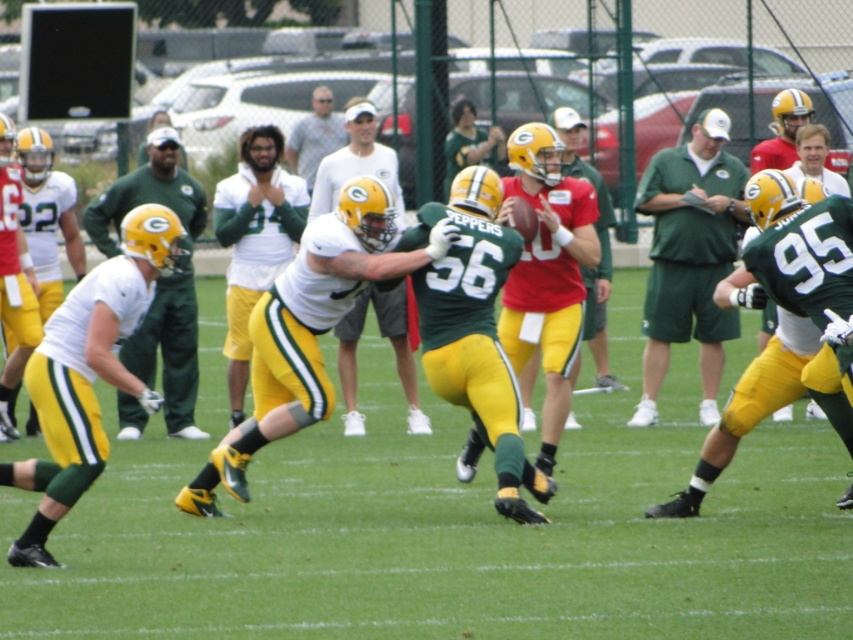
You are a sports equipment manager who needs to store the white matte jersey at center and the white cotton shirt at center in a locker with a width of 1 meter. Based on the description, will both items fit side by side in the locker?

The white matte jersey at center is wider than the white cotton shirt at center. Since the locker is 1 meter wide, it depends on the combined width of both items. However, the description only states the relative width between them, not their exact measurements. Without knowing the exact widths, we cannot definitively determine if they will fit side by side.

You are a photographer positioned at the edge of the field. You need to capture a closeup shot of both the green matte jersey at center and the white matte helmet at center. Given their sizes, which object should you focus on first to ensure it fits within your camera frame?

The green matte jersey at center is wider than the white matte helmet at center, so you should focus on the green matte jersey at center first to ensure it fits within your camera frame since it is larger in width.

You are a photographer positioned at the edge of the field. You need to capture a clear photo of the white matte jersey at center and the white cotton shirt at center. Which one is positioned lower in the frame?

The white matte jersey at center is positioned below the white cotton shirt at center, so it is lower in the frame.